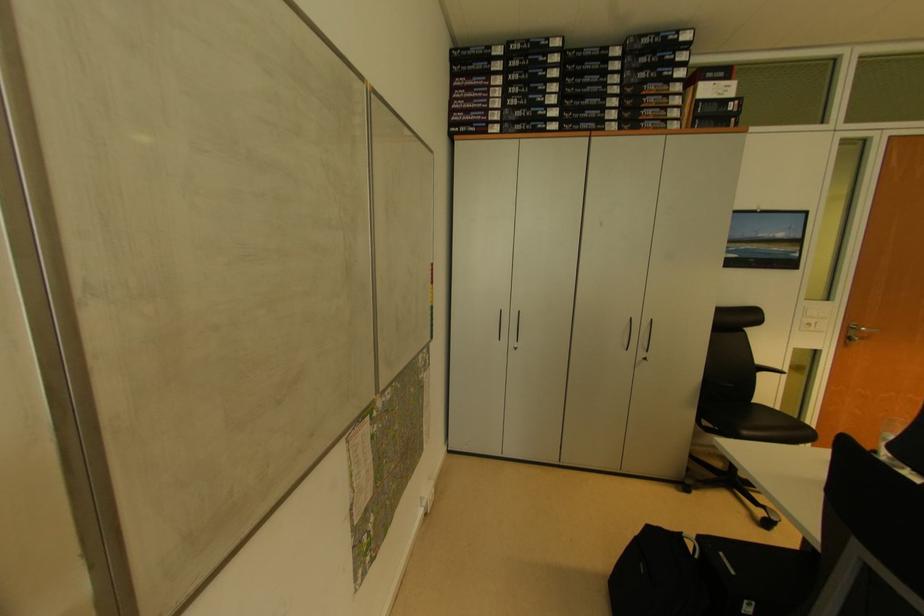
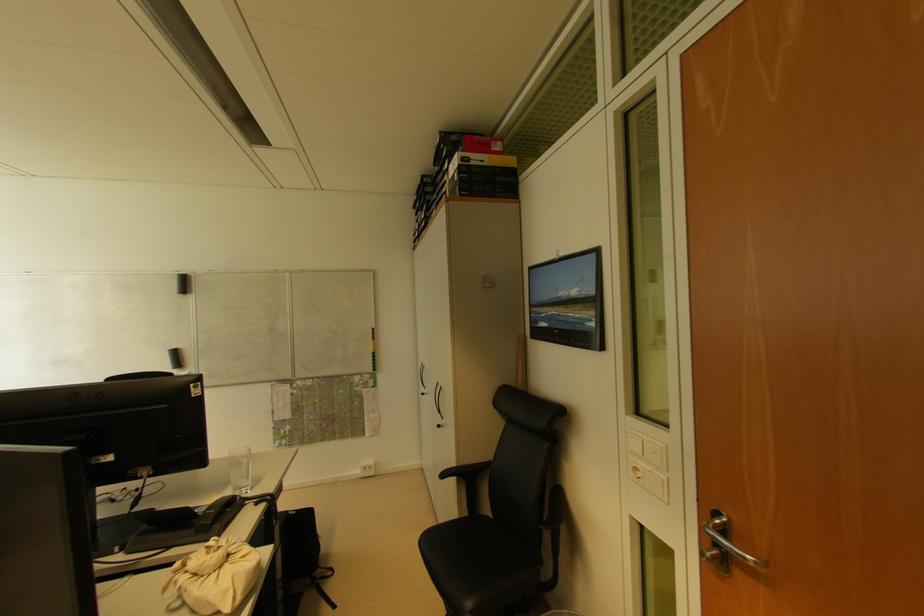
Where in the second image is the point corresponding to (x=734, y=107) from the first image?

(457, 177)